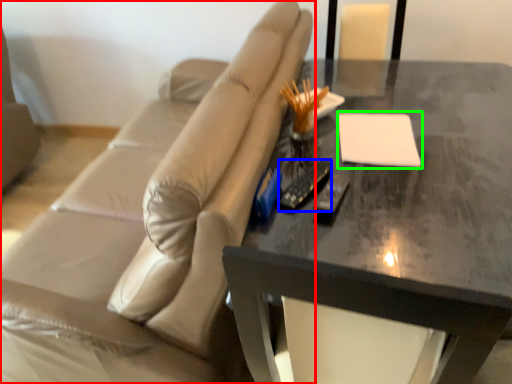
Question: Which is farther away from studio couch (highlighted by a red box)? remote (highlighted by a blue box) or notepad (highlighted by a green box)?

Choices:
 (A) remote
 (B) notepad

Answer: (A)